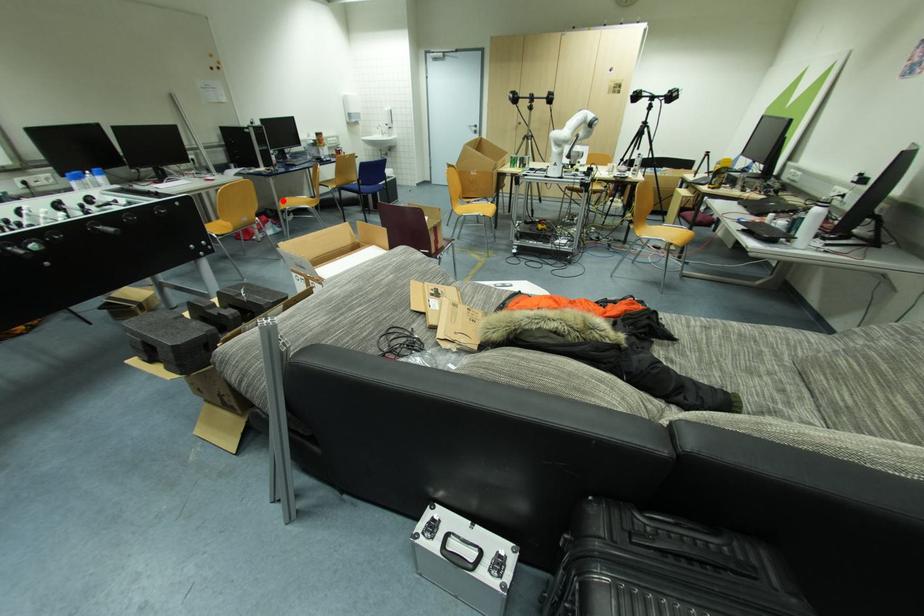
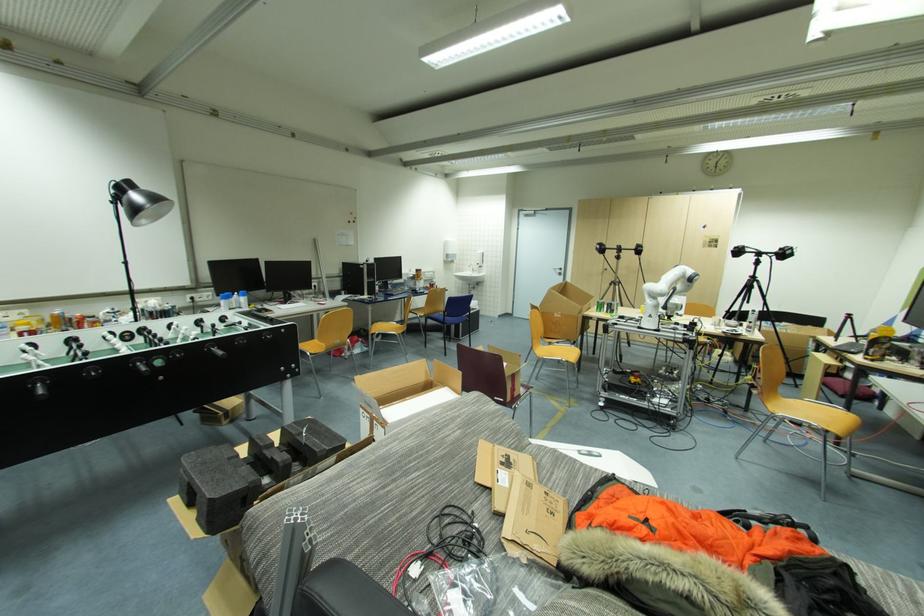
Question: I am providing you with two images of the same scene from different viewpoints. In image1, a red point is highlighted. Considering the same 3D point in image2, which of the following is correct?

Choices:
 (A) It is closer
 (B) It is farther

Answer: (B)